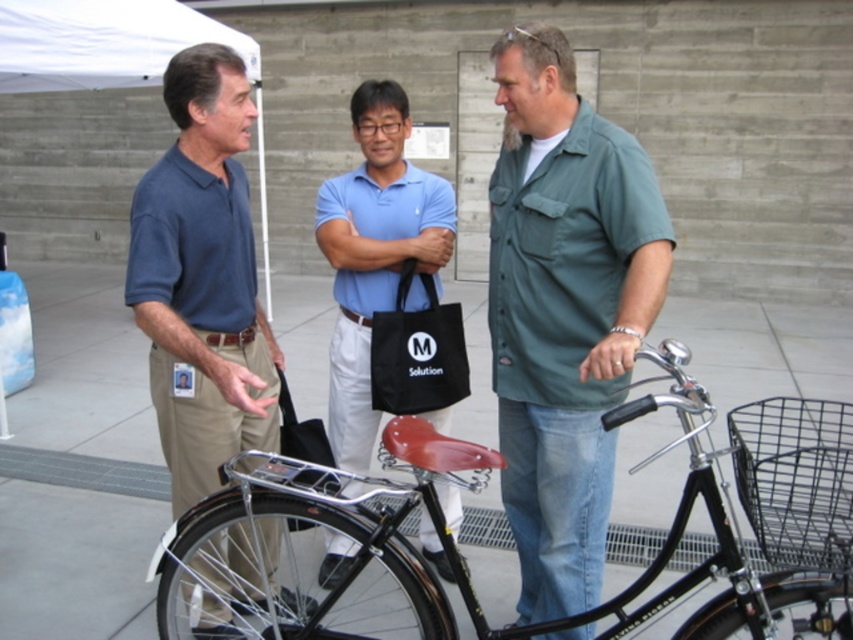
Question: Which object is positioned farthest from the shiny black bicycle at center?

Choices:
 (A) green cotton shirt at center
 (B) matte blue shirt at left
 (C) blue cotton polo shirt at center

Answer: (C)

Question: Is shiny black bicycle at center wider than matte blue shirt at left?

Choices:
 (A) no
 (B) yes

Answer: (B)

Question: Does green cotton shirt at center have a larger size compared to white fabric canopy at upper left?

Choices:
 (A) no
 (B) yes

Answer: (A)

Question: Which of the following is the closest to the observer?

Choices:
 (A) (167, 385)
 (B) (601, 227)

Answer: (B)

Question: Which object is the closest to the green cotton shirt at center?

Choices:
 (A) shiny black bicycle at center
 (B) blue cotton polo shirt at center

Answer: (A)

Question: Where is green cotton shirt at center located in relation to matte blue shirt at left in the image?

Choices:
 (A) below
 (B) above

Answer: (B)